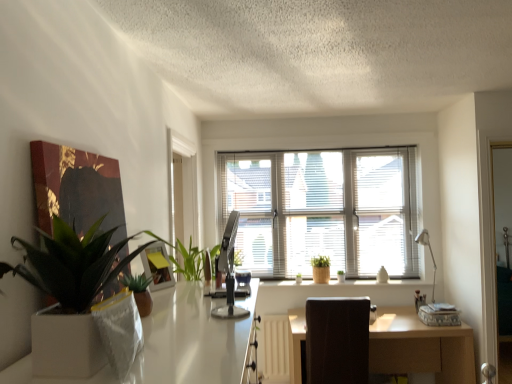
This screenshot has width=512, height=384. Find the location of `vacant point to the right of yellow paper picture frame at upper center`. vacant point to the right of yellow paper picture frame at upper center is located at coordinates (x=185, y=281).